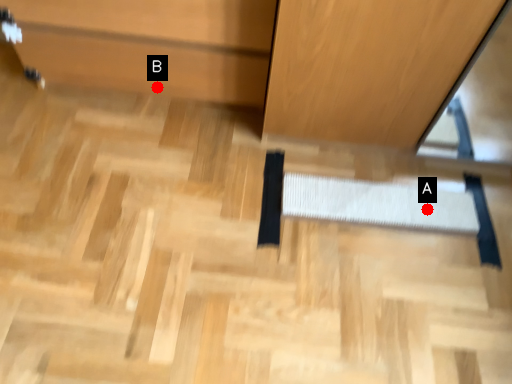
Question: Two points are circled on the image, labeled by A and B beside each circle. Which point appears farthest from the camera in this image?

Choices:
 (A) A is further
 (B) B is further

Answer: (B)